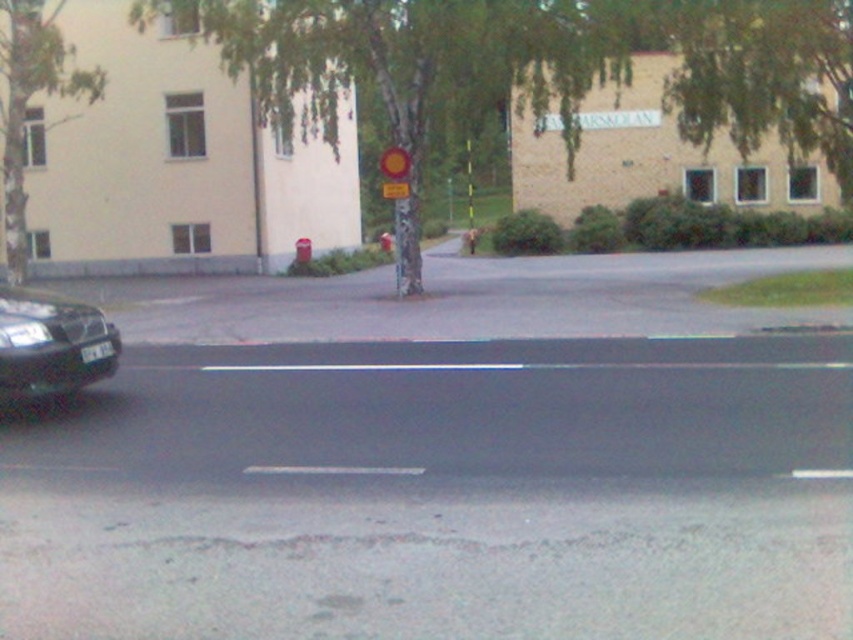
Does green bark tree at upper center have a greater height compared to shiny black car at left?

Correct, green bark tree at upper center is much taller as shiny black car at left.

Does point (10, 48) lie in front of point (61, 316)?

No, it is behind (61, 316).

Locate an element on the screen. green bark tree at upper center is located at coordinates (28, 99).

Looking at this image, does green bark tree at center appear on the left side of green bark tree at upper center?

Incorrect, green bark tree at center is not on the left side of green bark tree at upper center.

Is green bark tree at center thinner than green bark tree at upper center?

No.

The width and height of the screenshot is (853, 640). What do you see at coordinates (409, 65) in the screenshot? I see `green bark tree at center` at bounding box center [409, 65].

This screenshot has width=853, height=640. Find the location of `green bark tree at center`. green bark tree at center is located at coordinates (409, 65).

Who is positioned more to the left, green bark tree at center or yellow matte circle at center?

yellow matte circle at center is more to the left.

Does green bark tree at center have a lesser width compared to yellow matte circle at center?

No, green bark tree at center is not thinner than yellow matte circle at center.

Is point (329, 19) closer to viewer compared to point (398, 148)?

No, (329, 19) is behind (398, 148).

Locate an element on the screen. Image resolution: width=853 pixels, height=640 pixels. green bark tree at center is located at coordinates (409, 65).